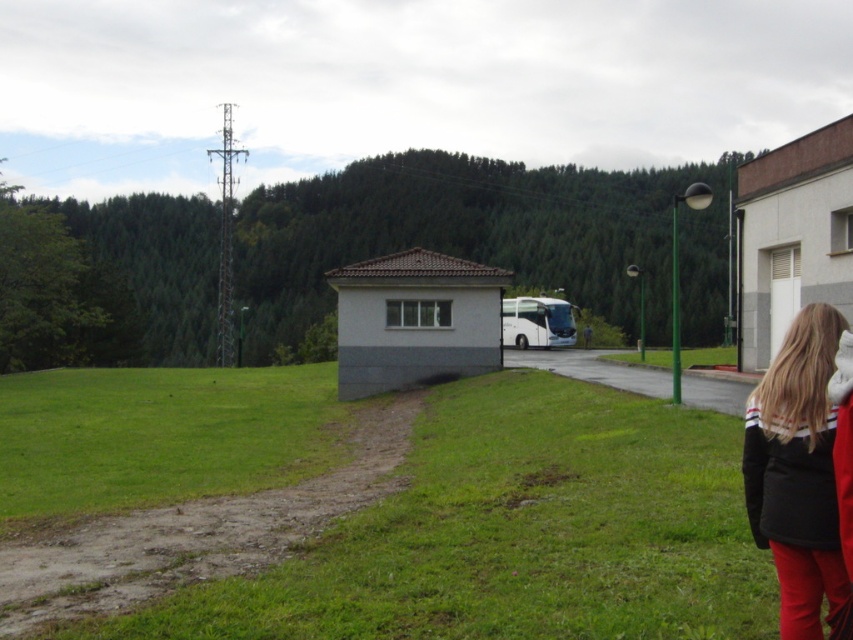
Question: Is black fleece jacket at lower right bigger than white glossy bus at center?

Choices:
 (A) yes
 (B) no

Answer: (B)

Question: Which point is closer to the camera taking this photo?

Choices:
 (A) (780, 536)
 (B) (549, 346)

Answer: (A)

Question: Does black fleece jacket at lower right lie in front of white glossy bus at center?

Choices:
 (A) no
 (B) yes

Answer: (B)

Question: Which object appears farthest from the camera in this image?

Choices:
 (A) white glossy bus at center
 (B) black fleece jacket at lower right

Answer: (A)

Question: In this image, where is black fleece jacket at lower right located relative to white glossy bus at center?

Choices:
 (A) below
 (B) above

Answer: (A)

Question: Which of the following is the closest to the observer?

Choices:
 (A) white glossy bus at center
 (B) black fleece jacket at lower right

Answer: (B)